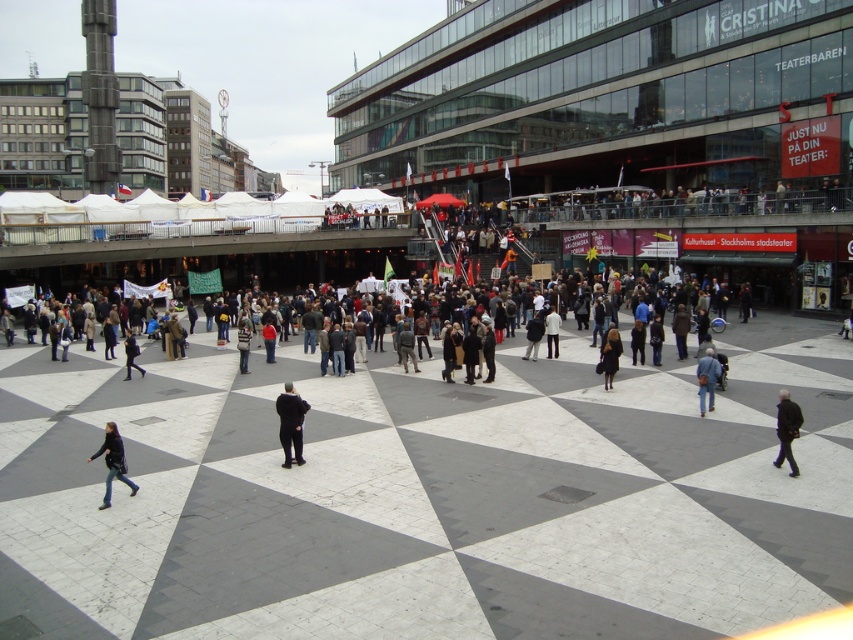
Question: From the image, what is the correct spatial relationship of denim jeans at lower left in relation to dark gray pants at lower left?

Choices:
 (A) below
 (B) above

Answer: (A)

Question: Which object is the closest to the light beige pants at center?

Choices:
 (A) black matte jacket at lower right
 (B) blue denim jeans at center
 (C) dark blue coat at center

Answer: (B)

Question: Is denim jeans at lower left to the right of black leather bag at center from the viewer's perspective?

Choices:
 (A) yes
 (B) no

Answer: (B)

Question: Which of the following is the closest to the observer?

Choices:
 (A) (704, 358)
 (B) (114, 444)

Answer: (B)

Question: Estimate the real-world distances between objects in this image. Which object is farther from the black matte jacket at lower right?

Choices:
 (A) dark gray pants at lower left
 (B) blue denim jeans at center

Answer: (A)

Question: Does black matte jacket at lower right appear over blue denim jeans at center?

Choices:
 (A) yes
 (B) no

Answer: (B)